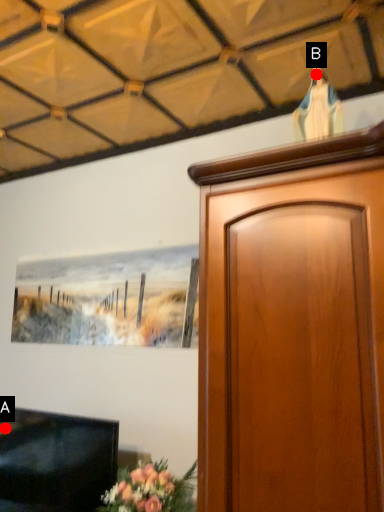
Question: Two points are circled on the image, labeled by A and B beside each circle. Among these points, which one is farthest from the camera?

Choices:
 (A) A is further
 (B) B is further

Answer: (A)